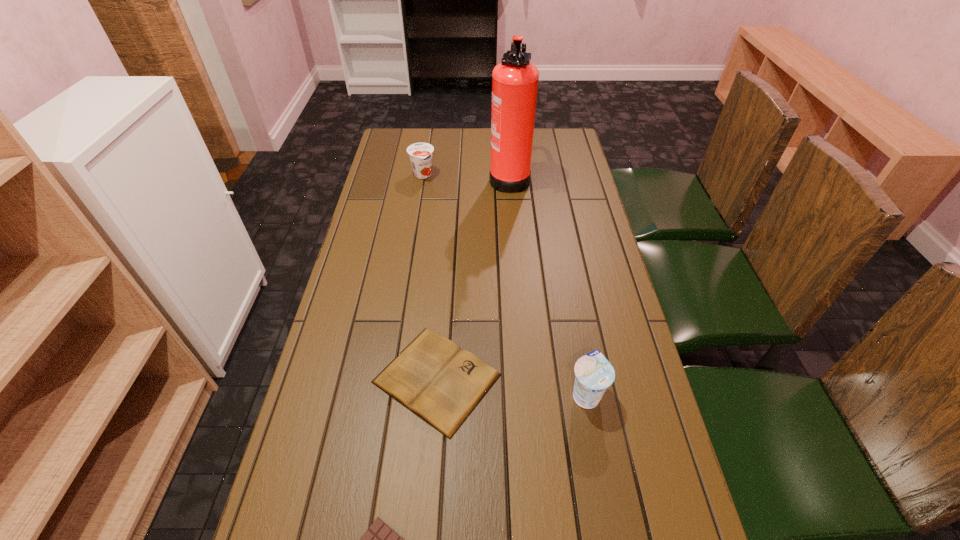
Where is `free space between the left yogurt and the book`? The height and width of the screenshot is (540, 960). free space between the left yogurt and the book is located at coordinates (430, 277).

I want to click on vacant point located between the book and the left yogurt, so click(430, 277).

The image size is (960, 540). I want to click on empty space that is in between the right yogurt and the book, so click(512, 387).

The height and width of the screenshot is (540, 960). Find the location of `free spot between the tallest object and the book`. free spot between the tallest object and the book is located at coordinates (473, 277).

The height and width of the screenshot is (540, 960). In order to click on empty space between the fire extinguisher and the book in this screenshot , I will do `click(473, 277)`.

Select which object appears as the fourth closest to the fire extinguisher. Please provide its 2D coordinates. Your answer should be formatted as a tuple, i.e. [(x, y)], where the tuple contains the x and y coordinates of a point satisfying the conditions above.

[(379, 539)]

Locate an element on the screen. The image size is (960, 540). object that stands as the third closest to the tallest object is located at coordinates (594, 373).

Where is `vacant space that satisfies the following two spatial constraints: 1. at the nozzle of the rightmost object; 2. on the left side of the tallest object`? vacant space that satisfies the following two spatial constraints: 1. at the nozzle of the rightmost object; 2. on the left side of the tallest object is located at coordinates (527, 395).

Locate an element on the screen. Image resolution: width=960 pixels, height=540 pixels. vacant point that satisfies the following two spatial constraints: 1. on the front side of the book; 2. on the right side of the left yogurt is located at coordinates (390, 379).